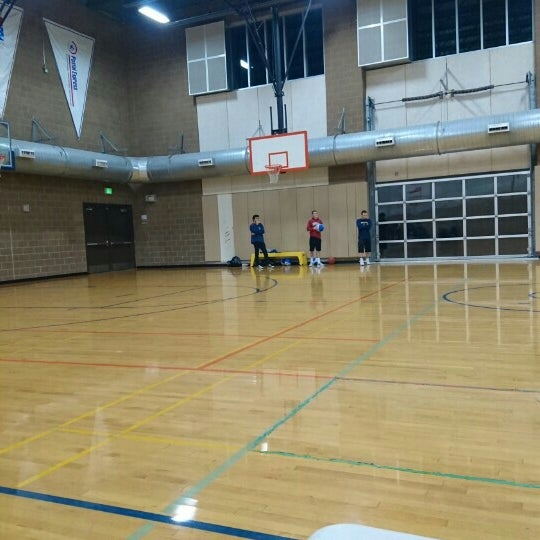
Image resolution: width=540 pixels, height=540 pixels. I want to click on exit sign, so click(x=107, y=194).